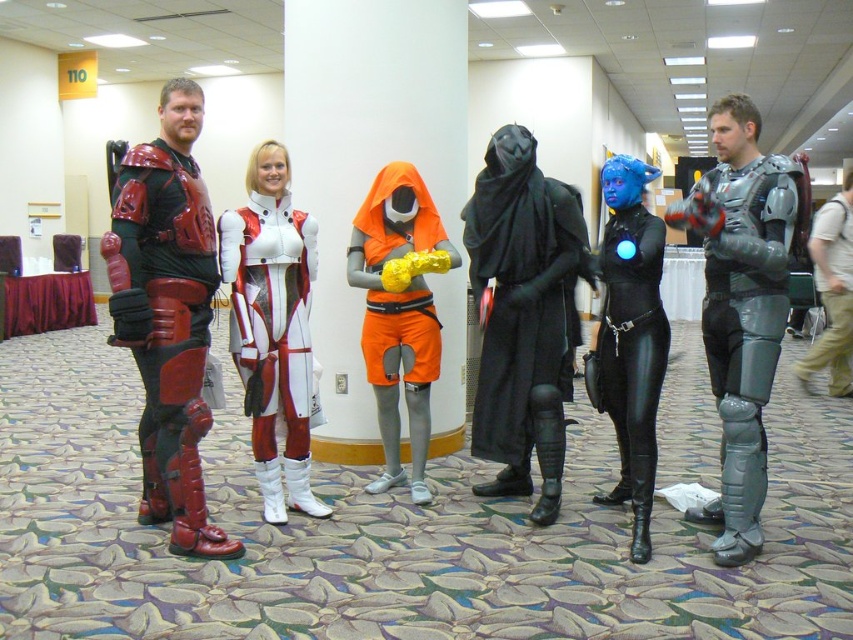
You are organizing a costume parade and need to arrange the black matte robe at center and the white glossy bodysuit at center in a line. Which costume should be placed first if you want the larger costume to be in front?

The black matte robe at center should be placed first because it has a larger size compared to the white glossy bodysuit at center.